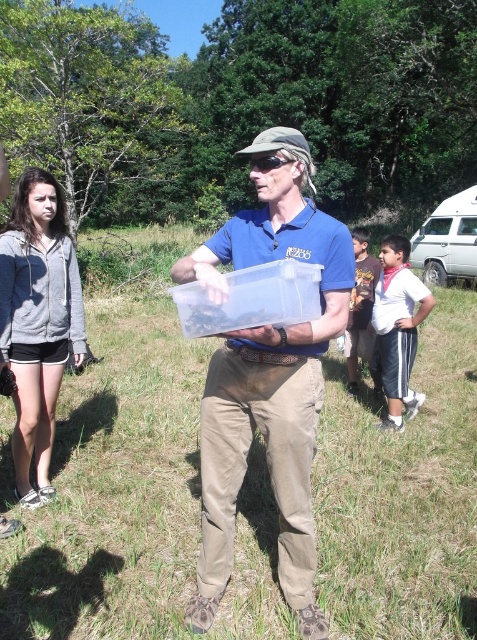
Which is more to the right, matte plastic container at center or white cotton shirt at center?

Positioned to the right is white cotton shirt at center.

Between point (245, 236) and point (372, 294), which one is positioned behind?

The point (372, 294) is behind.

I want to click on matte plastic container at center, so click(x=268, y=376).

Does green grass at center appear over gray hoodie at left?

No.

Measure the distance between green grass at center and gray hoodie at left.

green grass at center and gray hoodie at left are 7.06 feet apart from each other.

Does point (90, 488) lie in front of point (18, 493)?

No, it is not.

What are the coordinates of `green grass at center` in the screenshot? It's located at (115, 476).

Between gray hoodie at left and white cotton shirt at right, which one appears on the right side from the viewer's perspective?

white cotton shirt at right

Describe the element at coordinates (38, 321) in the screenshot. I see `gray hoodie at left` at that location.

Which is in front, point (26, 396) or point (390, 292)?

Positioned in front is point (26, 396).

The image size is (477, 640). What are the coordinates of `gray hoodie at left` in the screenshot? It's located at (38, 321).